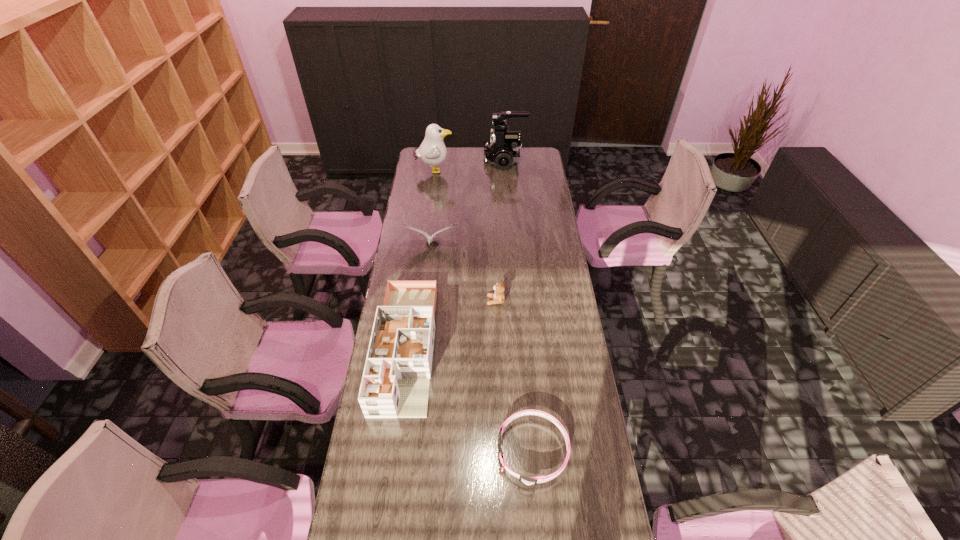
You are a GUI agent. You are given a task and a screenshot of the screen. Output one action in this format:
    pyautogui.click(x=<x>, y=<y>)
    Task: Click on the camcorder
    
    Given the screenshot: What is the action you would take?
    pyautogui.click(x=503, y=150)

Where is `the taller gull`? the taller gull is located at coordinates (432, 151).

Locate an element on the screen. The height and width of the screenshot is (540, 960). the nearer gull is located at coordinates (429, 238).

At what (x,y) coordinates should I click in order to perform the action: click on the shorter gull. Please return your answer as a coordinate pair (x, y). This screenshot has width=960, height=540. Looking at the image, I should click on (429, 238).

In order to click on dollhouse in this screenshot , I will do `click(395, 384)`.

This screenshot has height=540, width=960. I want to click on teddy bear, so click(x=498, y=296).

The image size is (960, 540). Find the location of `the shortest object`. the shortest object is located at coordinates (531, 481).

At what (x,y) coordinates should I click in order to perform the action: click on vacant space located 0.170m on the lens mount of the camcorder. Please return your answer as a coordinate pair (x, y). Looking at the image, I should click on (454, 160).

Find the location of a particular element. This screenshot has width=960, height=540. vacant space located on the lens mount of the camcorder is located at coordinates (452, 160).

The image size is (960, 540). I want to click on vacant space situated 0.060m on the lens mount of the camcorder, so click(x=473, y=160).